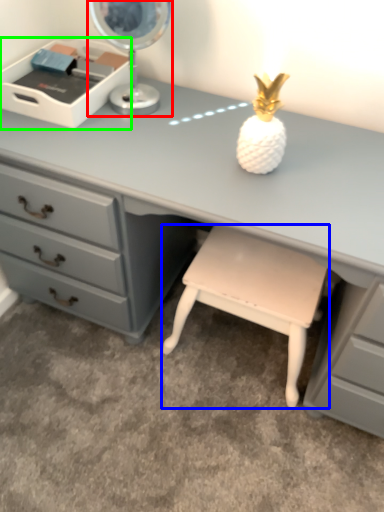
Question: Considering the real-world distances, which object is closest to table lamp (highlighted by a red box)? stool (highlighted by a blue box) or writing desk (highlighted by a green box).

Choices:
 (A) stool
 (B) writing desk

Answer: (B)